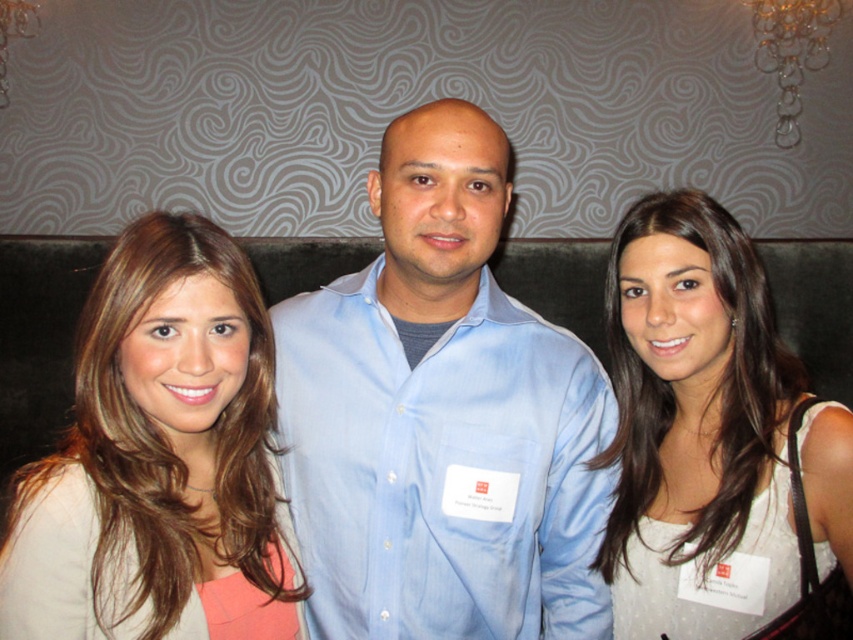
You are a photographer preparing to take a group portrait. You notice the light blue shirt at center and the white satin dress at center. Which clothing item is covering part of the other?

The light blue shirt at center is positioned over the white satin dress at center, so it is covering part of the white satin dress at center.

You are a photographer setting up for a group photo. You notice two elements at the center of the scene, the blonde hair at center and the white satin dress at center. Which one is located lower in the image?

The blonde hair at center is positioned under the white satin dress at center, so the blonde hair at center is lower than the white satin dress at center.

You are a photographer setting up for a group photo. You notice the light blue shirt at center and the blonde hair at center. Which object is layered in front of the other?

The light blue shirt at center is positioned over blonde hair at center, so the light blue shirt at center is in front of the blonde hair at center.